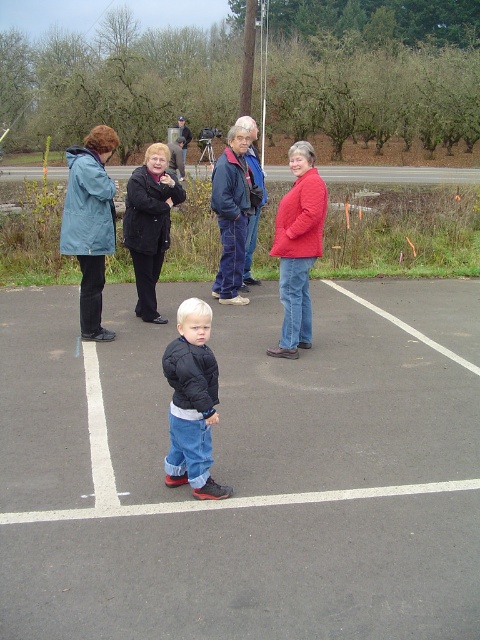
Question: Is black matte jacket at center to the right of black plastic tripod at center from the viewer's perspective?

Choices:
 (A) yes
 (B) no

Answer: (A)

Question: Based on their relative distances, which object is nearer to the black plastic tripod at center?

Choices:
 (A) dark blue jacket at center
 (B) black asphalt parking lot at center
 (C) black matte jacket at center
 (D) matte red jacket at center

Answer: (C)

Question: Which object is farther from the camera taking this photo?

Choices:
 (A) blue waterproof jacket at left
 (B) black matte jacket at center
 (C) dark blue jacket at center

Answer: (B)

Question: Is black asphalt parking lot at center wider than black matte jacket at center?

Choices:
 (A) yes
 (B) no

Answer: (A)

Question: Which object is positioned farthest from the black matte jacket at center?

Choices:
 (A) black asphalt parking lot at center
 (B) dark blue jacket at center
 (C) matte red jacket at center
 (D) black plastic tripod at center

Answer: (D)

Question: Can you confirm if dark blue jacket at center is positioned to the right of black plastic tripod at center?

Choices:
 (A) yes
 (B) no

Answer: (A)